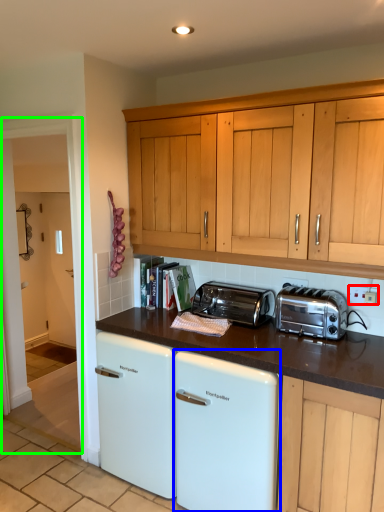
Question: Considering the real-world distances, which object is farthest from electric outlet (highlighted by a red box)? home appliance (highlighted by a blue box) or glass door (highlighted by a green box)?

Choices:
 (A) home appliance
 (B) glass door

Answer: (B)